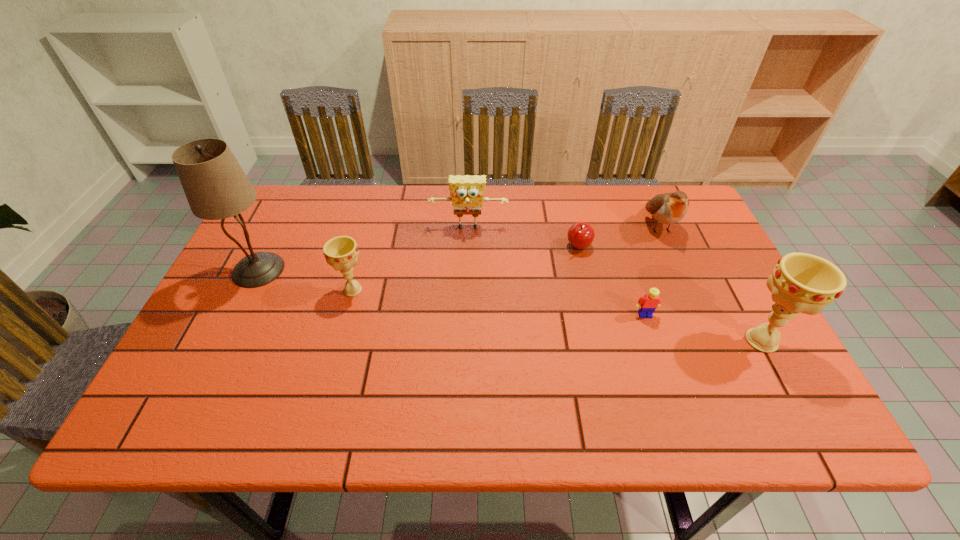
This screenshot has height=540, width=960. I want to click on the left chalice, so (x=341, y=252).

Locate an element on the screen. the farther chalice is located at coordinates (341, 252).

Identify the location of the nearer chalice. This screenshot has width=960, height=540. (800, 282).

What are the coordinates of `the rightmost object` in the screenshot? It's located at (800, 282).

Find the location of `the sixth object from left to right`. the sixth object from left to right is located at coordinates (668, 208).

The image size is (960, 540). In order to click on the fifth object from right to left in this screenshot , I will do `click(467, 192)`.

This screenshot has height=540, width=960. In order to click on lampshade in this screenshot , I will do `click(216, 187)`.

You are a GUI agent. You are given a task and a screenshot of the screen. Output one action in this format:
    pyautogui.click(x=<x>, y=<y>)
    Task: Click on the leftmost object
    The width and height of the screenshot is (960, 540).
    Given the screenshot: What is the action you would take?
    pyautogui.click(x=216, y=187)

In order to click on the sixth farthest object in this screenshot , I will do `click(647, 304)`.

Image resolution: width=960 pixels, height=540 pixels. I want to click on Lego, so click(647, 304).